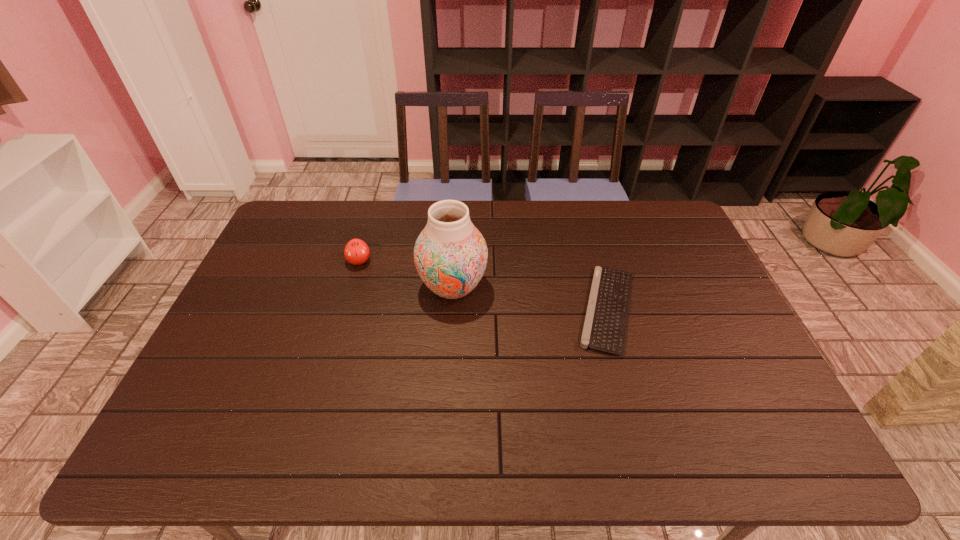
This screenshot has width=960, height=540. In order to click on vacant space at the near edge of the desktop in this screenshot , I will do `click(433, 444)`.

Find the location of a particular element. vacant space at the left edge is located at coordinates (289, 265).

In the image, there is a desktop. Where is `vacant space at the right edge`? Image resolution: width=960 pixels, height=540 pixels. vacant space at the right edge is located at coordinates (710, 329).

Find the location of `free region at the far right corner of the desktop`. free region at the far right corner of the desktop is located at coordinates (649, 204).

The image size is (960, 540). I want to click on vacant space that is in between the leftmost object and the second object from left to right, so click(406, 274).

Image resolution: width=960 pixels, height=540 pixels. In order to click on empty space between the leftmost object and the second object from right to left in this screenshot , I will do `click(406, 274)`.

Where is `unoccupied position between the shortest object and the apple`? unoccupied position between the shortest object and the apple is located at coordinates (483, 285).

Where is `vacant point located between the vase and the second tallest object`? This screenshot has width=960, height=540. vacant point located between the vase and the second tallest object is located at coordinates (406, 274).

This screenshot has height=540, width=960. I want to click on free point between the vase and the leftmost object, so click(x=406, y=274).

Identify the location of unoccupied area between the leftmost object and the rightmost object. The width and height of the screenshot is (960, 540). (483, 285).